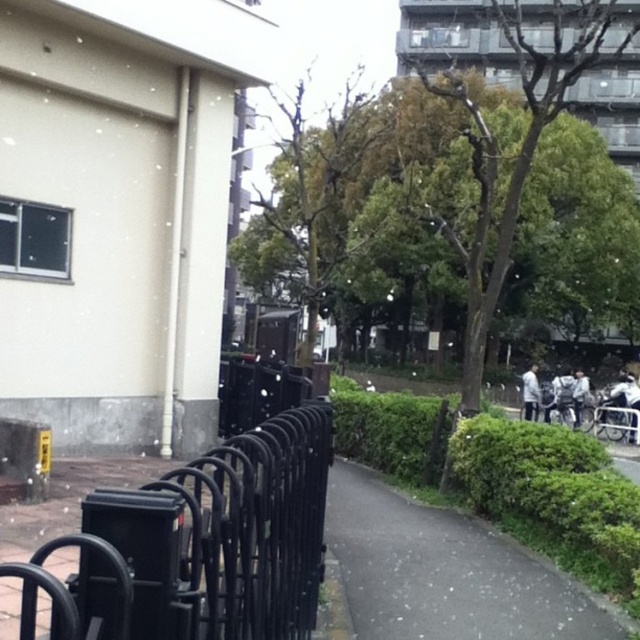
Which is in front, point (378, 598) or point (577, 424)?

Point (378, 598) is more forward.

Does green grass at lower right appear under light gray fabric jacket at right?

Yes, green grass at lower right is below light gray fabric jacket at right.

Between point (362, 577) and point (577, 410), which one is positioned behind?

Positioned behind is point (577, 410).

Find the location of a particular element. green grass at lower right is located at coordinates (445, 572).

Between black metal fence at left and light gray fabric jacket at right, which one has less height?

light gray fabric jacket at right

I want to click on black metal fence at left, so click(198, 545).

Is point (58, 589) in front of point (577, 406)?

That is True.

Image resolution: width=640 pixels, height=640 pixels. Identify the location of black metal fence at left. (198, 545).

This screenshot has height=640, width=640. What do you see at coordinates (198, 545) in the screenshot? I see `black metal fence at left` at bounding box center [198, 545].

Can you confirm if black metal fence at left is smaller than white matte jacket at right?

No.

Locate an element on the screen. The height and width of the screenshot is (640, 640). black metal fence at left is located at coordinates (198, 545).

Identify the location of black metal fence at left. (198, 545).